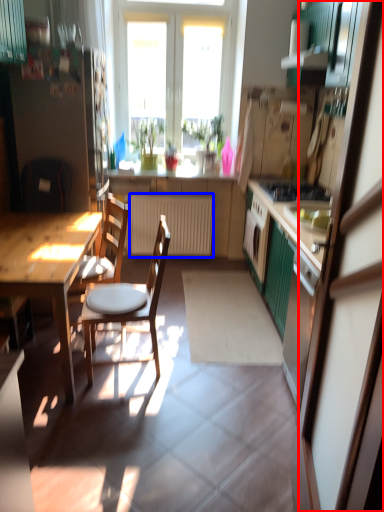
Question: Which point is closer to the camera, screen door (highlighted by a red box) or radiator (highlighted by a blue box)?

Choices:
 (A) screen door
 (B) radiator

Answer: (A)